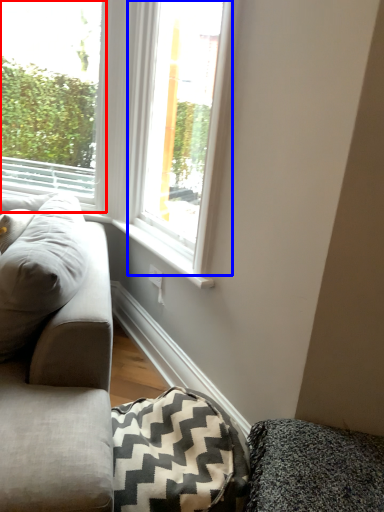
Question: Which object appears farthest to the camera in this image, window (highlighted by a red box) or window (highlighted by a blue box)?

Choices:
 (A) window
 (B) window

Answer: (A)